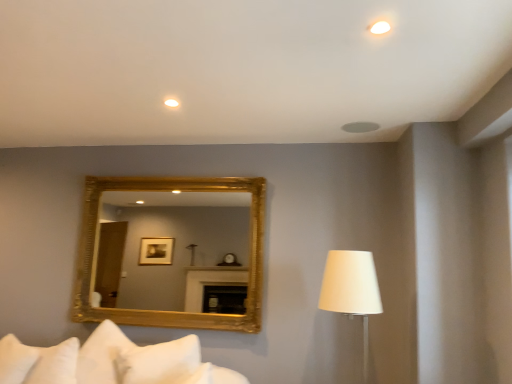
Identify the location of vacant space to the left of white matte ceiling light at upper center, the first lighting in the bottom-to-top sequence. The width and height of the screenshot is (512, 384). (142, 97).